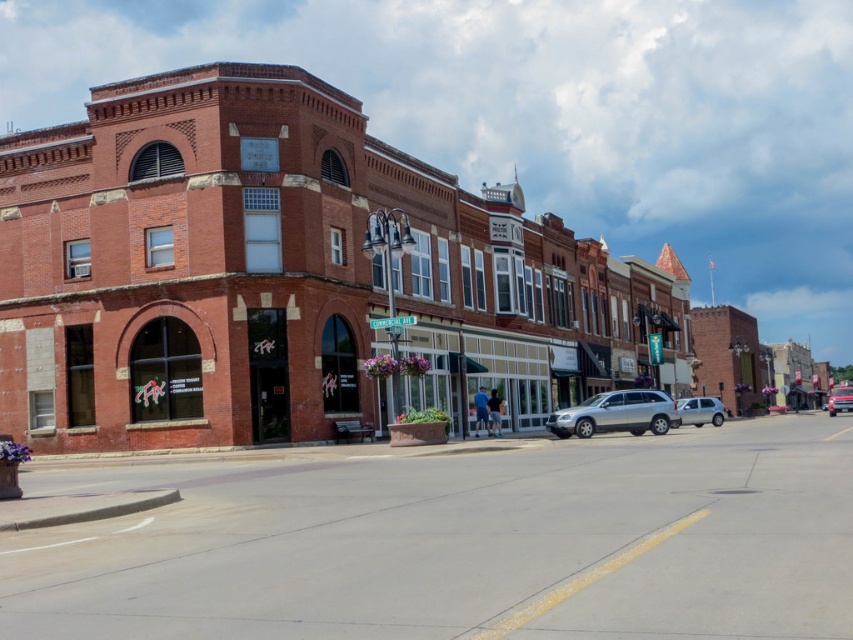
Question: Is red brick building at center below metallic silver suv at center?

Choices:
 (A) no
 (B) yes

Answer: (A)

Question: Which object is the closest to the red brick building at center?

Choices:
 (A) satin silver suv at center-right
 (B) metallic silver suv at center
 (C) silver metallic suv at center

Answer: (C)

Question: Which of these objects is positioned farthest from the red brick building at center?

Choices:
 (A) metallic silver suv at center
 (B) silver metallic suv at center

Answer: (A)

Question: Is the position of silver metallic suv at center more distant than that of satin silver suv at center-right?

Choices:
 (A) no
 (B) yes

Answer: (A)

Question: Which of these objects is positioned closest to the red brick building at center?

Choices:
 (A) metallic silver suv at center
 (B) silver metallic suv at center

Answer: (B)

Question: Does silver metallic suv at center have a greater width compared to metallic silver suv at center?

Choices:
 (A) no
 (B) yes

Answer: (A)